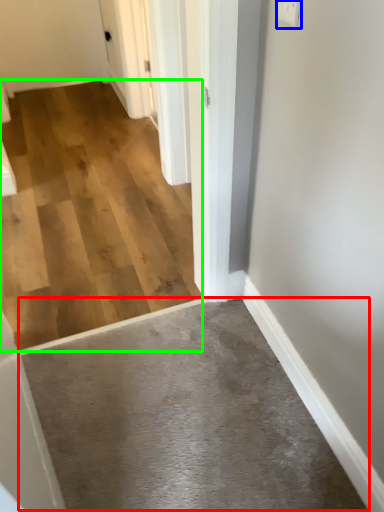
Question: Which is nearer to the concrete (highlighted by a red box)? electric outlet (highlighted by a blue box) or concrete (highlighted by a green box).

Choices:
 (A) electric outlet
 (B) concrete

Answer: (B)